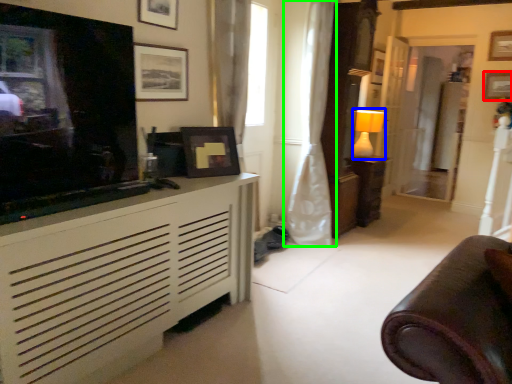
Question: Which object is the farthest from picture frame (highlighted by a red box)? Choose among these: lamp (highlighted by a blue box) or curtain (highlighted by a green box).

Choices:
 (A) lamp
 (B) curtain

Answer: (B)